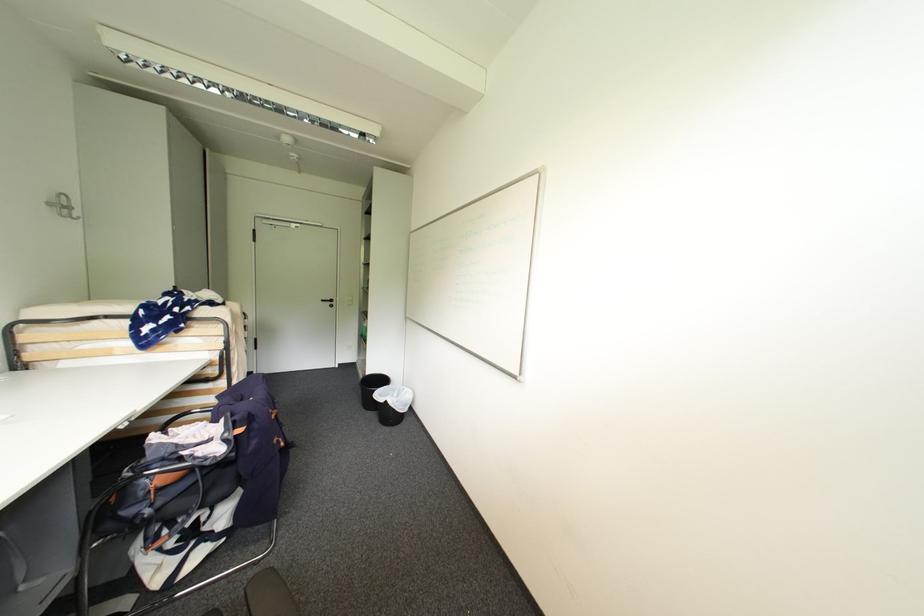
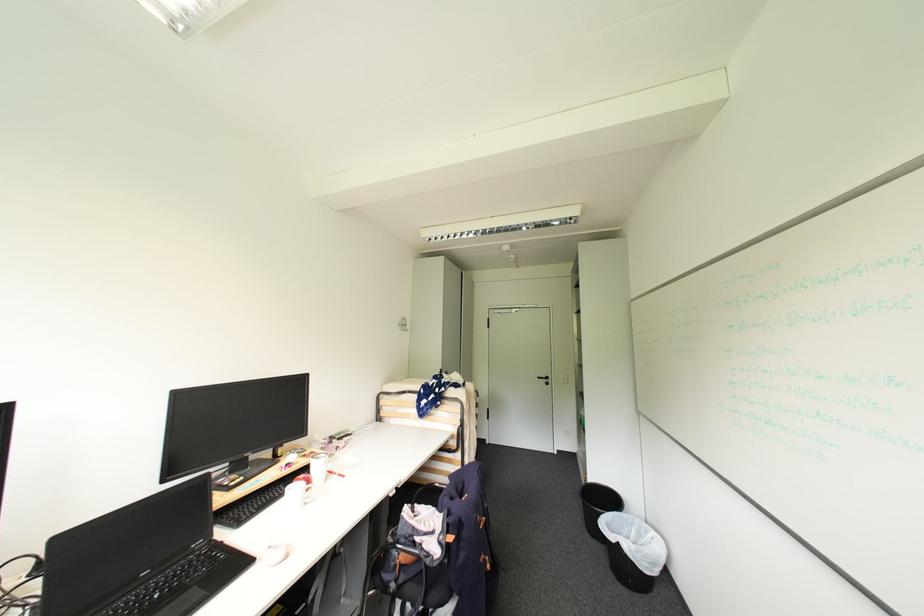
Find the pixel in the second image that matches pixel 233 436 in the first image.

(447, 538)